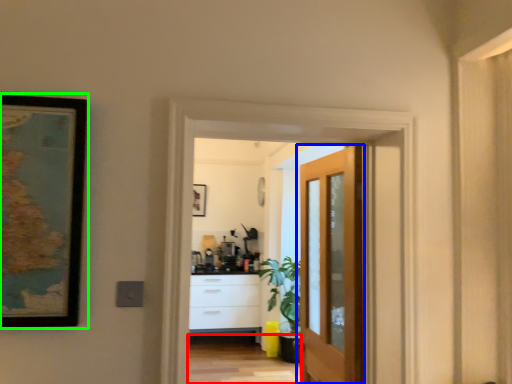
Question: Which is farther away from path (highlighted by a red box)? door (highlighted by a blue box) or picture frame (highlighted by a green box)?

Choices:
 (A) door
 (B) picture frame

Answer: (B)